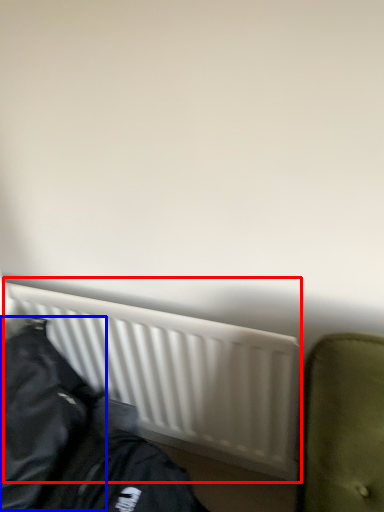
Question: Which point is closer to the camera, radiator (highlighted by a red box) or jacket (highlighted by a blue box)?

Choices:
 (A) radiator
 (B) jacket

Answer: (B)